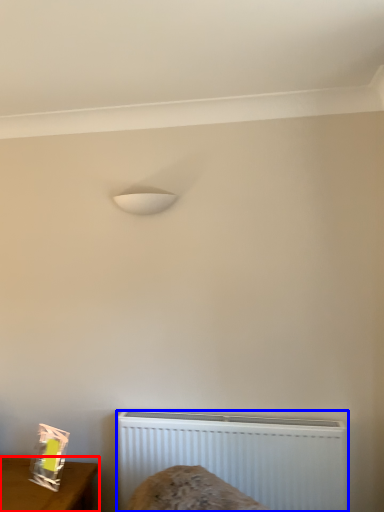
Question: Which point is closer to the camera, furniture (highlighted by a red box) or radiator (highlighted by a blue box)?

Choices:
 (A) furniture
 (B) radiator

Answer: (A)